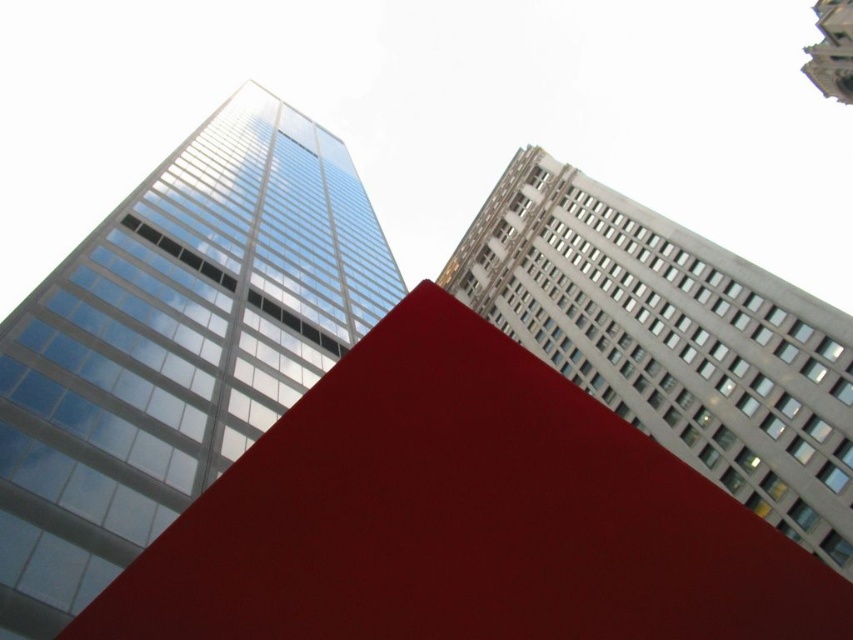
Can you confirm if white textured building at upper right is thinner than smooth stone tower at upper right?

In fact, white textured building at upper right might be wider than smooth stone tower at upper right.

Is point (711, 285) closer to viewer compared to point (840, 90)?

Yes, point (711, 285) is in front of point (840, 90).

The image size is (853, 640). I want to click on white textured building at upper right, so click(x=672, y=340).

Who is lower down, glassy reflective skyscraper at left or smooth stone tower at upper right?

glassy reflective skyscraper at left is below.

Does glassy reflective skyscraper at left appear on the right side of smooth stone tower at upper right?

Incorrect, glassy reflective skyscraper at left is not on the right side of smooth stone tower at upper right.

Who is more distant from viewer, [19,547] or [817,56]?

Positioned behind is point [817,56].

Identify the location of glassy reflective skyscraper at left. The image size is (853, 640). (175, 346).

Can you confirm if glassy reflective skyscraper at left is shorter than white textured building at upper right?

Indeed, glassy reflective skyscraper at left has a lesser height compared to white textured building at upper right.

Is glassy reflective skyscraper at left behind white textured building at upper right?

No, it is not.

In order to click on glassy reflective skyscraper at left in this screenshot , I will do `click(175, 346)`.